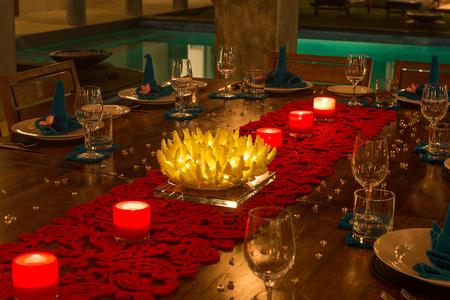
Find the location of a particular element. This screenshot has height=300, width=450. wine glasses is located at coordinates (89, 124), (370, 156), (439, 121), (359, 79), (232, 64), (192, 76), (258, 243).